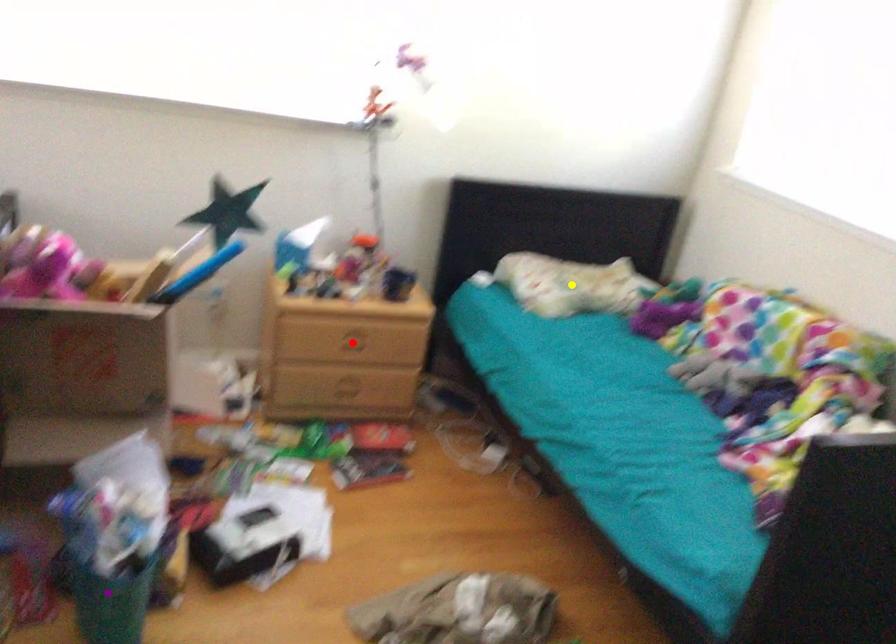
Order these from nearest to farthest:
red point, yellow point, purple point

purple point
red point
yellow point